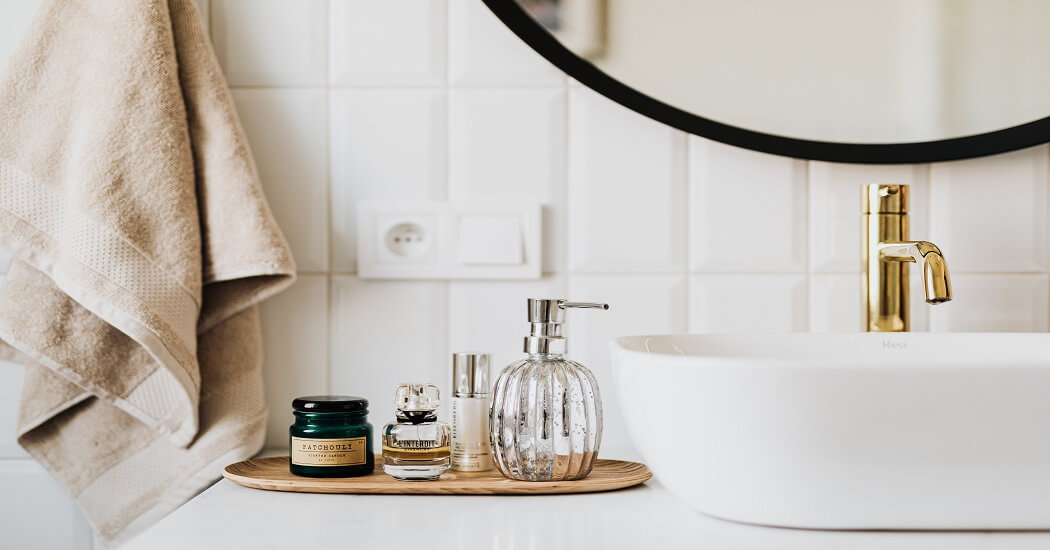
Identify the location of light switch. (492, 243).